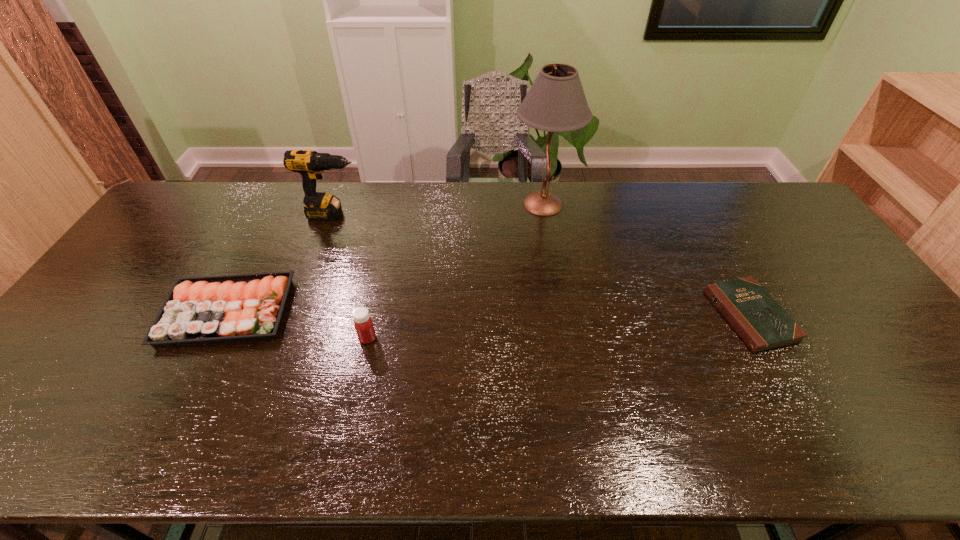
The width and height of the screenshot is (960, 540). In order to click on vacant point at the far left corner in this screenshot , I will do `click(219, 199)`.

I want to click on vacant position at the far right corner of the desktop, so click(x=772, y=185).

Locate an element on the screen. free space at the near right corner of the desktop is located at coordinates (955, 432).

Find the location of a particular element. free spot between the platter and the fourth shortest object is located at coordinates (280, 263).

Image resolution: width=960 pixels, height=540 pixels. Find the location of `free spot between the fourth tallest object and the fourth shortest object`. free spot between the fourth tallest object and the fourth shortest object is located at coordinates click(280, 263).

Find the location of a particular element. The image size is (960, 540). blank region between the shortest object and the fourth tallest object is located at coordinates (489, 314).

I want to click on free spot between the rightmost object and the drill, so click(541, 265).

At what (x,y) coordinates should I click in order to perform the action: click on vacant region between the third shortest object and the fourth shortest object. Please return your answer as a coordinate pair (x, y). The height and width of the screenshot is (540, 960). Looking at the image, I should click on (350, 276).

You are a GUI agent. You are given a task and a screenshot of the screen. Output one action in this format:
    pyautogui.click(x=<x>, y=<y>)
    Task: Click on the free spot between the drill and the rightmost object
    
    Given the screenshot: What is the action you would take?
    pyautogui.click(x=541, y=265)

Find the location of `vacant space that is in between the platter and the rightmost object`. vacant space that is in between the platter and the rightmost object is located at coordinates (489, 314).